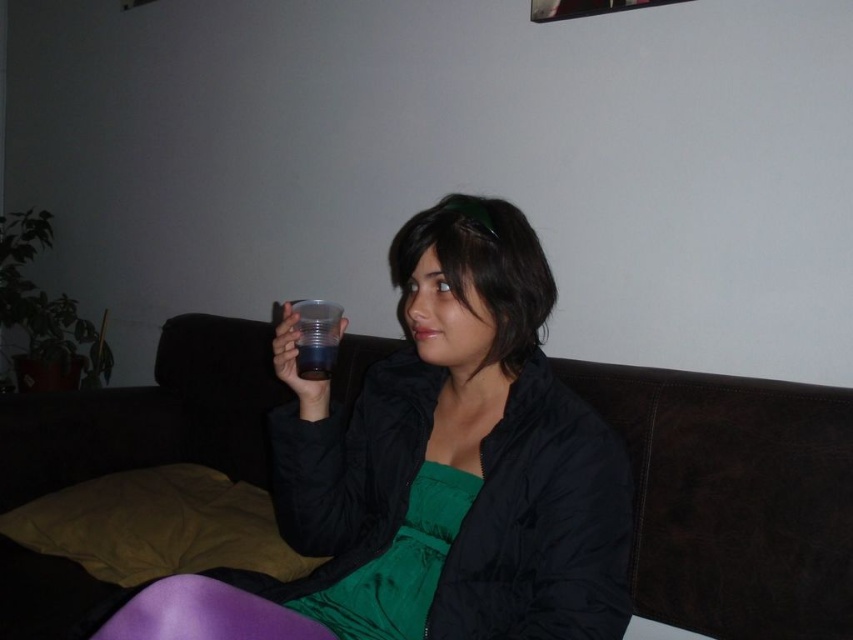
Question: Among these points, which one is nearest to the camera?

Choices:
 (A) (672, 486)
 (B) (437, 570)

Answer: (B)

Question: Considering the relative positions of brown leather couch at center and green satin dress at center in the image provided, where is brown leather couch at center located with respect to green satin dress at center?

Choices:
 (A) right
 (B) left

Answer: (B)

Question: Estimate the real-world distances between objects in this image. Which object is farther from the green satin dress at center?

Choices:
 (A) transparent plastic cup at upper center
 (B) brown leather couch at center

Answer: (B)

Question: Estimate the real-world distances between objects in this image. Which object is farther from the green satin dress at center?

Choices:
 (A) brown leather couch at center
 (B) transparent plastic cup at upper center

Answer: (A)

Question: Is brown leather couch at center thinner than green satin dress at center?

Choices:
 (A) yes
 (B) no

Answer: (B)

Question: Can you confirm if brown leather couch at center is bigger than transparent plastic cup at upper center?

Choices:
 (A) no
 (B) yes

Answer: (B)